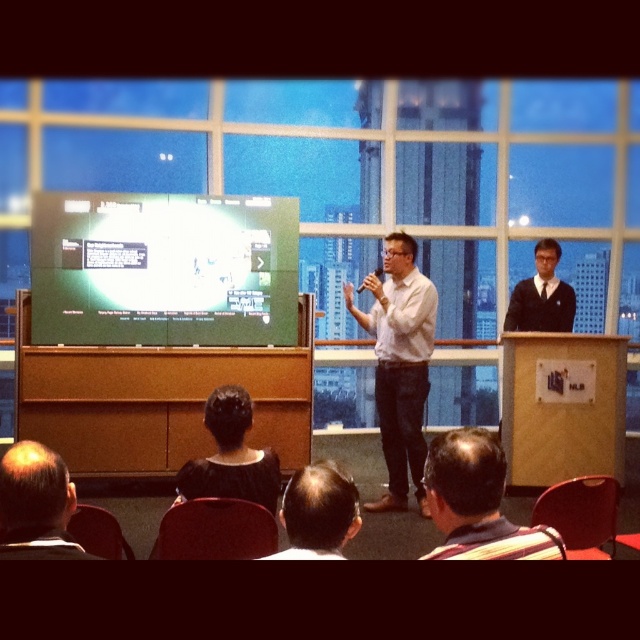
You are an attendee in the conference room and want to know which of the two points, point (458, 470) or point (573, 296), is closer to you. Based on the scene description, which point is nearer?

Point (458, 470) is closer to the viewer than point (573, 296).

You are standing in the conference room and want to take a photo of the two points mentioned. Which point, point (285, 266) or point (536, 275), will appear larger in your photo?

Point (285, 266) will appear larger in the photo because it is closer to the camera than point (536, 275).

You are an event organizer who needs to ensure that all participants can see the presentation screen. You notice the white shirt at center and the bald head at lower left in the front row. Which participant has a wider profile that might block the view of others?

The white shirt at center has a wider profile than the bald head at lower left, so it might block the view of others more.